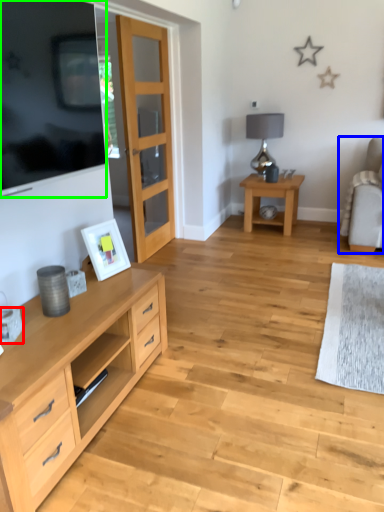
Question: Based on their relative distances, which object is farther from coffee cup (highlighted by a red box)? Choose from chair (highlighted by a blue box) and television (highlighted by a green box).

Choices:
 (A) chair
 (B) television

Answer: (A)